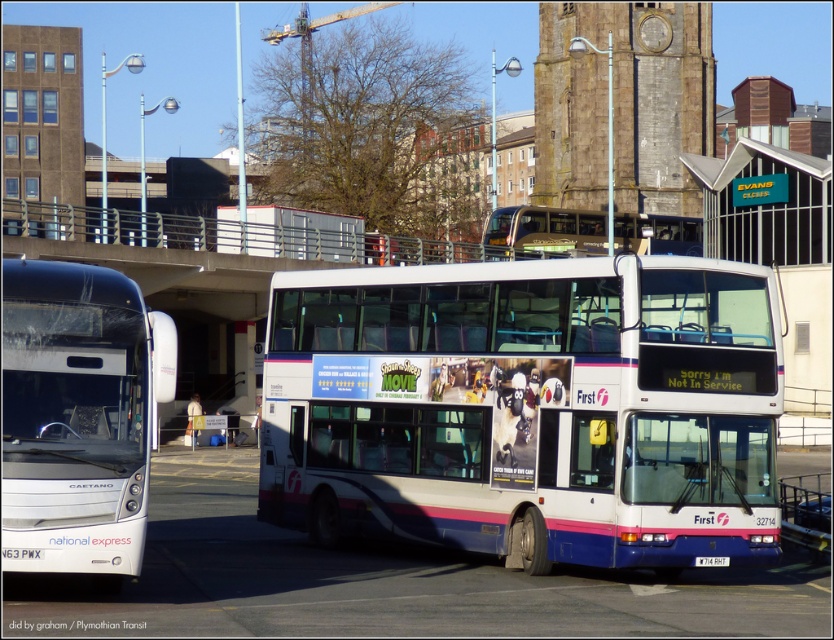
Question: Estimate the real-world distances between objects in this image. Which object is closer to the white matte bus at left?

Choices:
 (A) gold metallic bus at center
 (B) white plastic bus at center

Answer: (B)

Question: Can you confirm if white matte bus at left is positioned above gold metallic bus at center?

Choices:
 (A) no
 (B) yes

Answer: (A)

Question: Does white plastic bus at center have a greater width compared to white matte bus at left?

Choices:
 (A) yes
 (B) no

Answer: (B)

Question: Can you confirm if white plastic bus at center is bigger than gold metallic bus at center?

Choices:
 (A) no
 (B) yes

Answer: (A)

Question: Among these points, which one is farthest from the camera?

Choices:
 (A) (390, 524)
 (B) (9, 273)
 (C) (652, 232)

Answer: (C)

Question: Estimate the real-world distances between objects in this image. Which object is farther from the white plastic bus at center?

Choices:
 (A) white matte bus at left
 (B) gold metallic bus at center

Answer: (B)